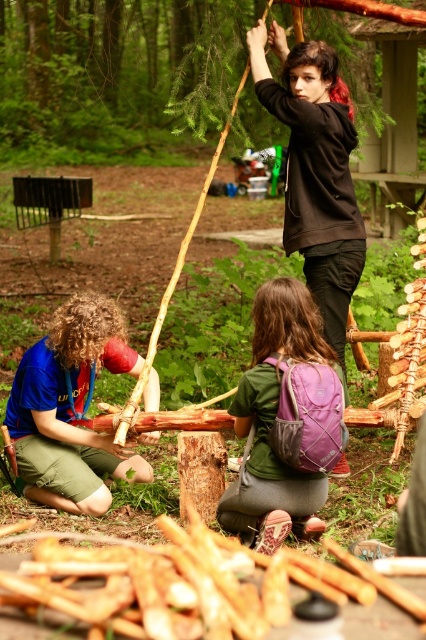
You are standing at the origin point of the image. Where is the black matte hoodie at upper center located?

The black matte hoodie at upper center is located at point 0.267 on the x axis and 0.742 on the y axis.

You are a photographer aiming to capture a photo of the black matte hoodie at upper center and the blue fabric shirt at lower left. Which object should you focus on first if you want to include both in the same frame without moving the camera?

The black matte hoodie at upper center is located above the blue fabric shirt at lower left, so you should focus on the black matte hoodie at upper center first to ensure both are in the frame.